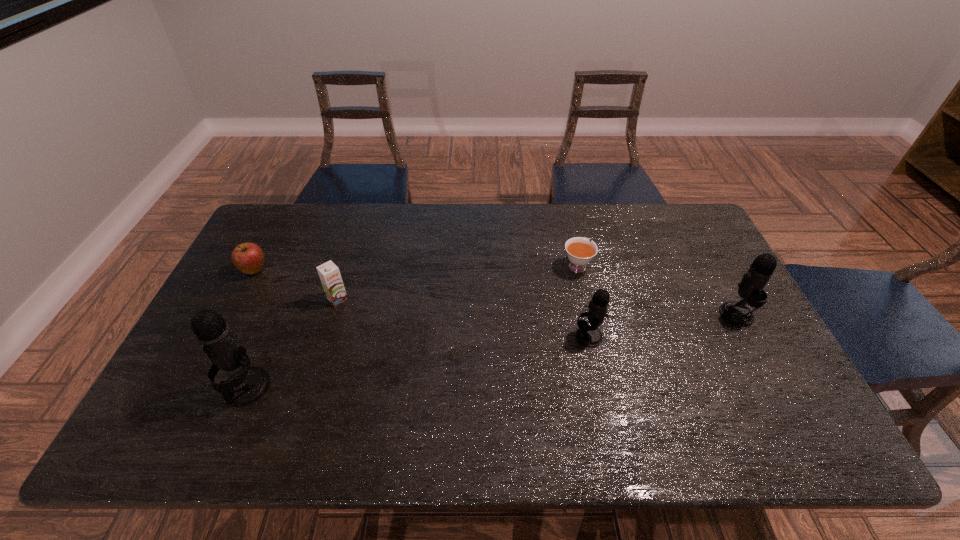
The height and width of the screenshot is (540, 960). In order to click on empty location between the third shortest object and the leftmost microphone in this screenshot , I will do `click(292, 343)`.

At what (x,y) coordinates should I click in order to perform the action: click on empty space that is in between the fourth shortest object and the tallest object. Please return your answer as a coordinate pair (x, y). Image resolution: width=960 pixels, height=540 pixels. Looking at the image, I should click on (418, 362).

Find the location of a particular element. The image size is (960, 540). free space between the teacup and the rightmost object is located at coordinates (657, 290).

Where is `free space between the chocolate milk and the second microphone from right to left`? Image resolution: width=960 pixels, height=540 pixels. free space between the chocolate milk and the second microphone from right to left is located at coordinates (463, 318).

Find the location of a particular element. Image resolution: width=960 pixels, height=540 pixels. free spot between the nearest microphone and the leftmost object is located at coordinates (251, 329).

The image size is (960, 540). In order to click on vacant area that lies between the shortest microphone and the fifth object from right to left in this screenshot , I will do `click(418, 362)`.

At what (x,y) coordinates should I click in order to perform the action: click on vacant area that lies between the leftmost object and the chocolate milk. Please return your answer as a coordinate pair (x, y). The width and height of the screenshot is (960, 540). Looking at the image, I should click on (296, 285).

The image size is (960, 540). Identify the location of free space that is in between the rightmost object and the nearest object. (492, 351).

Identify which object is the third nearest to the shortest object. Please provide its 2D coordinates. Your answer should be formatted as a tuple, i.e. [(x, y)], where the tuple contains the x and y coordinates of a point satisfying the conditions above.

[(329, 273)]

Point out which object is positioned as the fourth nearest to the third shortest object. Please provide its 2D coordinates. Your answer should be formatted as a tuple, i.e. [(x, y)], where the tuple contains the x and y coordinates of a point satisfying the conditions above.

[(588, 335)]